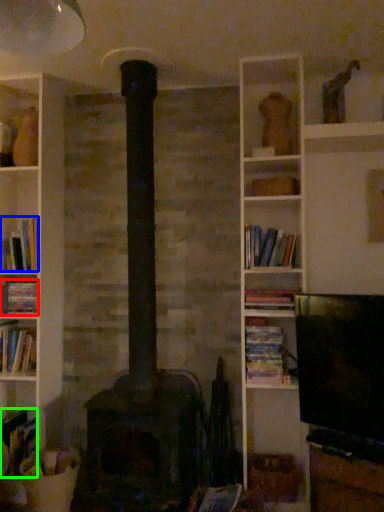
Question: Which is nearer to the book (highlighted by a red box)? book (highlighted by a blue box) or book (highlighted by a green box).

Choices:
 (A) book
 (B) book

Answer: (A)